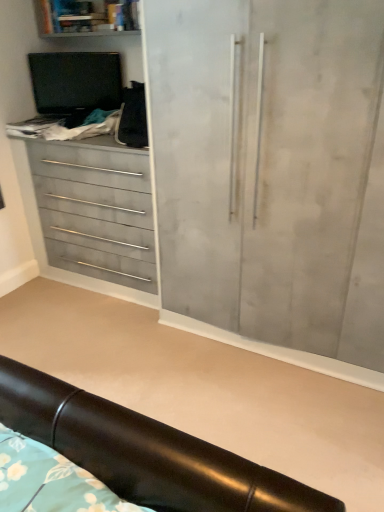
Question: Can you confirm if matte gray cupboard at center is bigger than matte gray shelf at upper left?

Choices:
 (A) no
 (B) yes

Answer: (B)

Question: Is matte gray cupboard at center shorter than matte gray shelf at upper left?

Choices:
 (A) yes
 (B) no

Answer: (B)

Question: From a real-world perspective, is matte gray cupboard at center beneath matte gray shelf at upper left?

Choices:
 (A) no
 (B) yes

Answer: (B)

Question: Does matte gray cupboard at center have a greater width compared to matte gray shelf at upper left?

Choices:
 (A) no
 (B) yes

Answer: (B)

Question: Is matte gray cupboard at center facing towards matte gray shelf at upper left?

Choices:
 (A) no
 (B) yes

Answer: (A)

Question: Can you confirm if matte gray cupboard at center is positioned to the left of matte gray shelf at upper left?

Choices:
 (A) yes
 (B) no

Answer: (B)

Question: Does matte gray drawers at left turn towards black leather headboard at lower center?

Choices:
 (A) yes
 (B) no

Answer: (A)

Question: Can you confirm if matte gray drawers at left is taller than black leather headboard at lower center?

Choices:
 (A) no
 (B) yes

Answer: (B)

Question: Can you confirm if matte gray drawers at left is bigger than black leather headboard at lower center?

Choices:
 (A) no
 (B) yes

Answer: (B)

Question: Is matte gray drawers at left far from black leather headboard at lower center?

Choices:
 (A) yes
 (B) no

Answer: (A)

Question: Does matte gray drawers at left appear on the right side of black leather headboard at lower center?

Choices:
 (A) no
 (B) yes

Answer: (A)

Question: Does matte gray drawers at left have a lesser width compared to black leather headboard at lower center?

Choices:
 (A) no
 (B) yes

Answer: (B)

Question: Is black leather headboard at lower center placed right next to matte gray drawers at left?

Choices:
 (A) yes
 (B) no

Answer: (B)